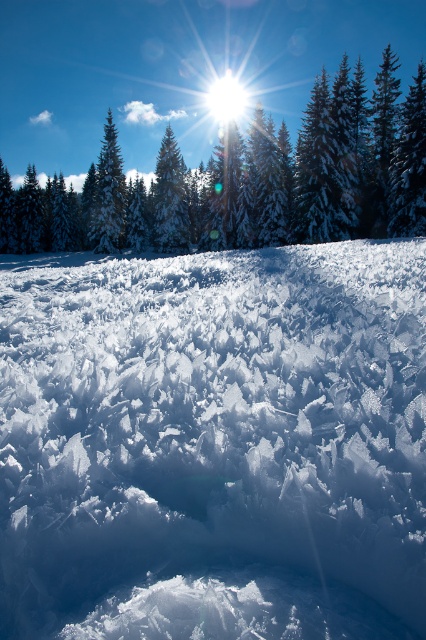
Describe the element at coordinates (247, 180) in the screenshot. I see `green frosted pine at upper center` at that location.

Does green frosted pine at upper center appear under green matte tree at center?

Incorrect, green frosted pine at upper center is not positioned below green matte tree at center.

This screenshot has height=640, width=426. I want to click on green frosted pine at upper center, so (247, 180).

This screenshot has width=426, height=640. Find the location of `green frosted pine at upper center`. green frosted pine at upper center is located at coordinates (247, 180).

Which is above, white crystalline snow at center or green frosted pine at upper center?

green frosted pine at upper center is above.

I want to click on white crystalline snow at center, so click(213, 444).

Identify the location of white crystalline snow at center. This screenshot has width=426, height=640. (213, 444).

Which is above, green matte tree at upper center or green matte tree at center?

green matte tree at upper center is higher up.

Is point (97, 212) farther from viewer compared to point (189, 236)?

Yes, it is behind point (189, 236).

You are a GUI agent. You are given a task and a screenshot of the screen. Output one action in this format:
    pyautogui.click(x=<x>, y=<y>)
    Task: Click on the green matte tree at upper center
    Image resolution: width=426 pixels, height=640 pixels.
    Given the screenshot: What is the action you would take?
    pyautogui.click(x=106, y=195)